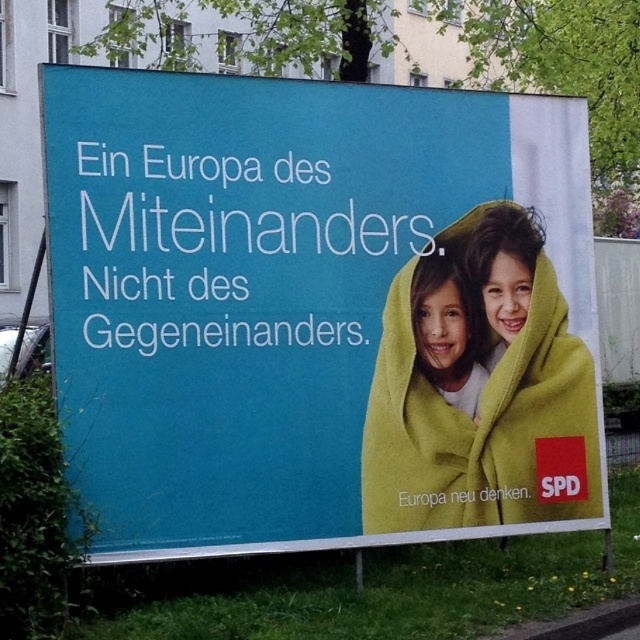
Can you confirm if green fleece blanket at right is positioned to the left of smooth yellow blanket at center?

Incorrect, green fleece blanket at right is not on the left side of smooth yellow blanket at center.

Is point (529, 221) positioned before point (464, 296)?

No, (529, 221) is behind (464, 296).

The height and width of the screenshot is (640, 640). I want to click on green fleece blanket at right, so click(480, 387).

Consider the image. Which is below, matte yellow blanket at center or smooth yellow blanket at center?

smooth yellow blanket at center is below.

You are a GUI agent. You are given a task and a screenshot of the screen. Output one action in this format:
    pyautogui.click(x=<x>, y=<y>)
    Task: Click on the matte yellow blanket at center
    This screenshot has width=640, height=640.
    Given the screenshot: What is the action you would take?
    pyautogui.click(x=317, y=310)

This screenshot has height=640, width=640. In order to click on matte yellow blanket at center in this screenshot , I will do `click(317, 310)`.

Which is below, matte yellow blanket at center or green fleece blanket at right?

green fleece blanket at right is lower down.

Is matte yellow blanket at center taller than green fleece blanket at right?

Correct, matte yellow blanket at center is much taller as green fleece blanket at right.

What do you see at coordinates (317, 310) in the screenshot? This screenshot has width=640, height=640. I see `matte yellow blanket at center` at bounding box center [317, 310].

You are a GUI agent. You are given a task and a screenshot of the screen. Output one action in this format:
    pyautogui.click(x=<x>, y=<y>)
    Task: Click on the matte yellow blanket at center
    This screenshot has height=640, width=640.
    Given the screenshot: What is the action you would take?
    pyautogui.click(x=317, y=310)